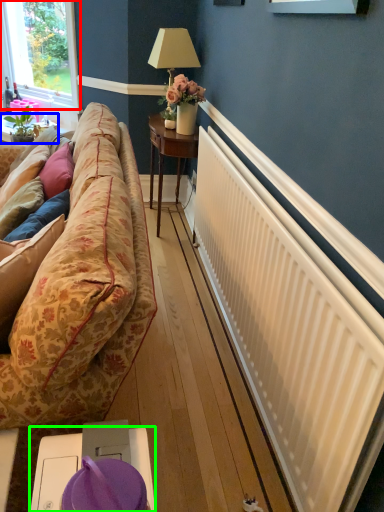
Question: Which object is the farthest from window (highlighted by a red box)? Choose among these: table (highlighted by a blue box) or table (highlighted by a green box).

Choices:
 (A) table
 (B) table

Answer: (B)